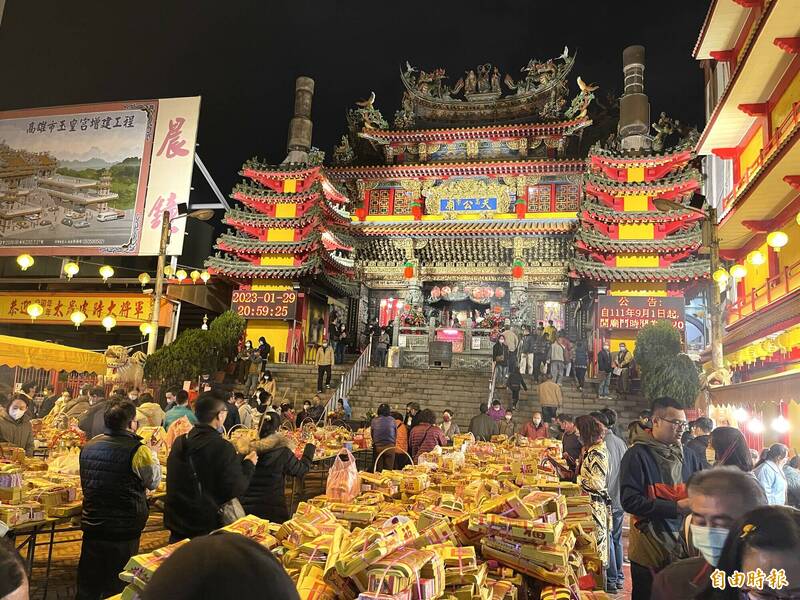
This screenshot has height=600, width=800. Find the location of `clock`. clock is located at coordinates (290, 307).